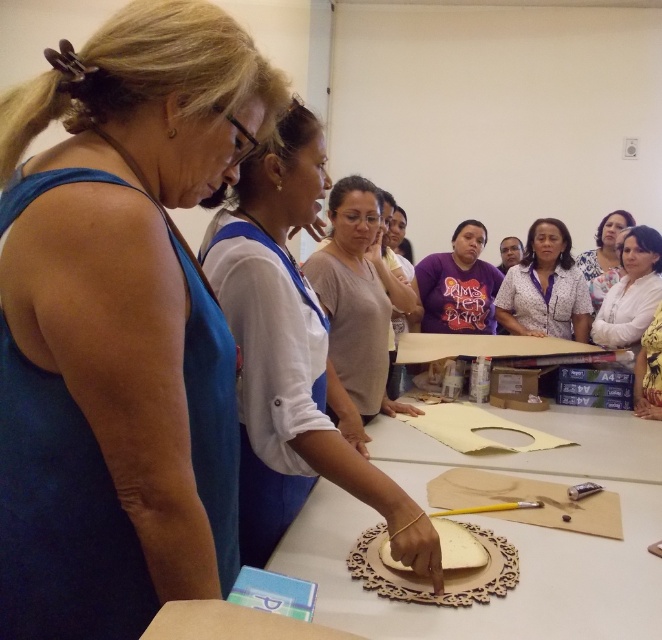
Does white textured blouse at upper center come behind white fabric at upper center?

That is False.

Does white textured blouse at upper center have a greater width compared to white fabric at upper center?

No, white textured blouse at upper center is not wider than white fabric at upper center.

What do you see at coordinates (632, 291) in the screenshot? I see `white textured blouse at upper center` at bounding box center [632, 291].

Locate an element on the screen. This screenshot has width=662, height=640. white textured blouse at upper center is located at coordinates (632, 291).

Does purple cotton shirt at center have a greater width compared to white matte bread at center?

Yes, purple cotton shirt at center is wider than white matte bread at center.

Does purple cotton shirt at center have a lesser height compared to white matte bread at center?

No, purple cotton shirt at center is not shorter than white matte bread at center.

Does point (420, 285) come in front of point (440, 531)?

No.

In order to click on purple cotton shirt at center in this screenshot , I will do `click(457, 285)`.

Which is in front, point (551, 260) or point (624, 308)?

Point (624, 308) is more forward.

Is white dotted blouse at center bigger than white textured blouse at upper center?

Indeed, white dotted blouse at center has a larger size compared to white textured blouse at upper center.

Does point (520, 312) lie in front of point (639, 262)?

No, (520, 312) is behind (639, 262).

Locate an element on the screen. This screenshot has height=640, width=662. white dotted blouse at center is located at coordinates (545, 288).